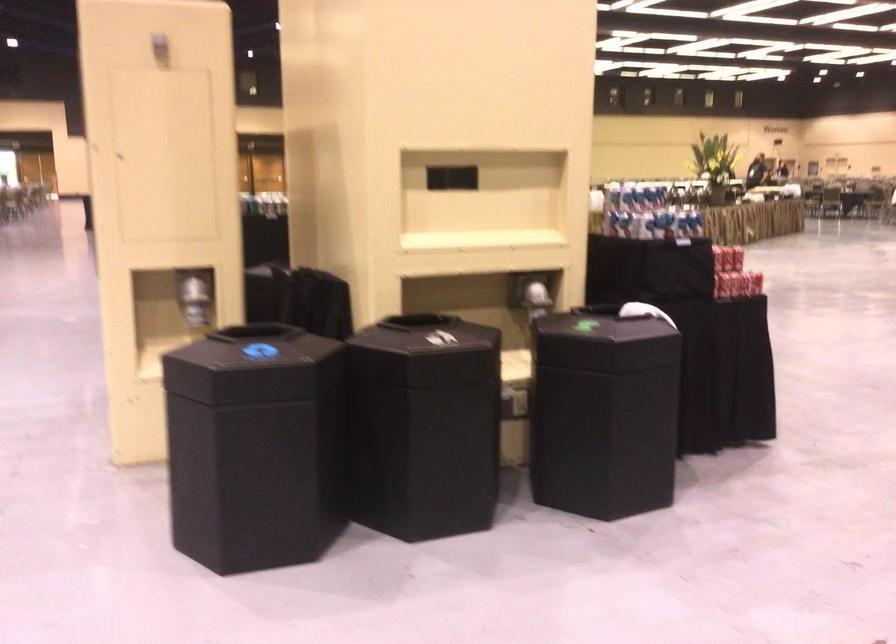
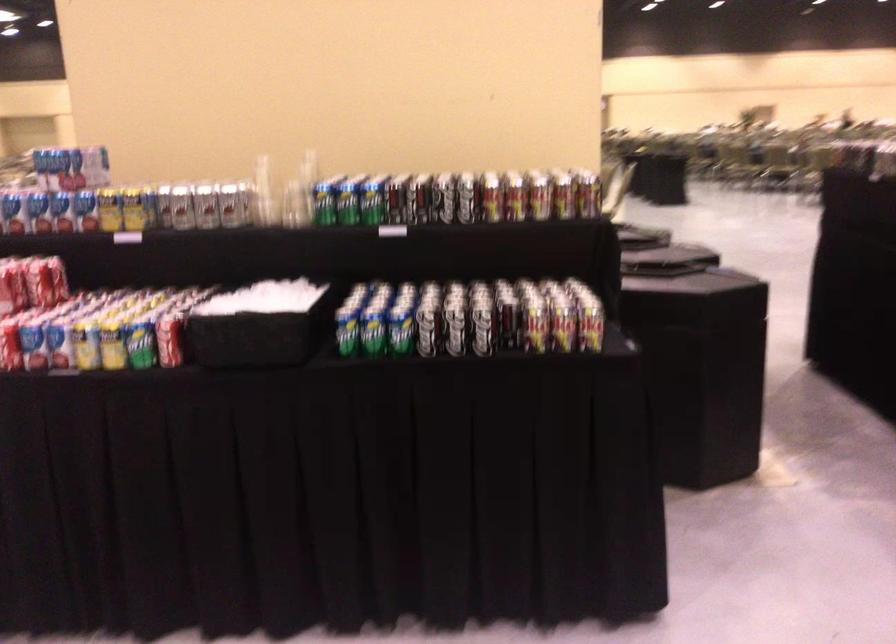
Where in the second image is the point corresponding to (694,218) from the first image?

(13, 209)